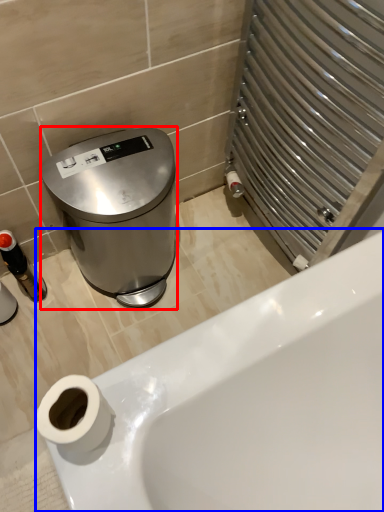
Question: Which object appears closest to the camera in this image, appliance (highlighted by a red box) or bathtub (highlighted by a blue box)?

Choices:
 (A) appliance
 (B) bathtub

Answer: (A)